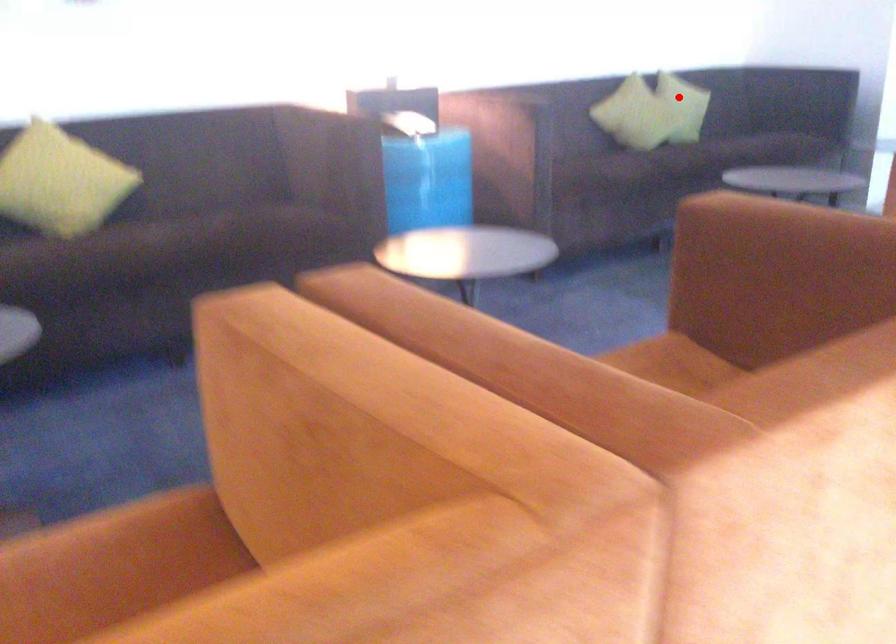
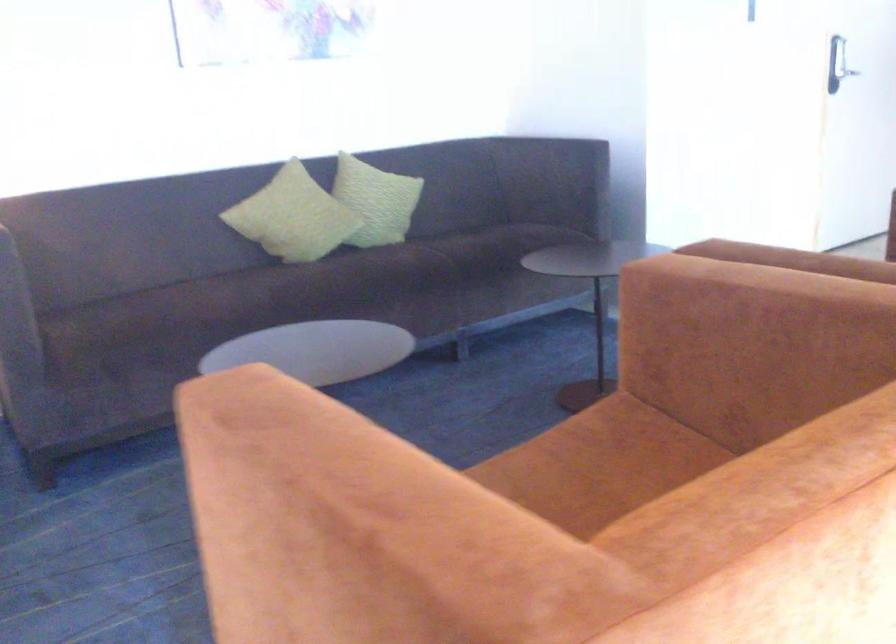
Question: I am providing you with two images of the same scene from different viewpoints. Given a red point in image1, look at the same physical point in image2. Is it:

Choices:
 (A) Closer to the viewpoint
 (B) Farther from the viewpoint

Answer: (A)